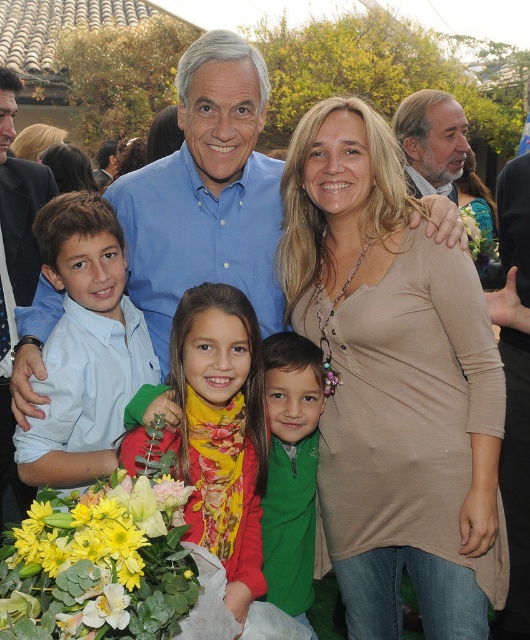
Does yellow matte flowers at lower left have a larger size compared to green fleece jacket at center?

No, yellow matte flowers at lower left is not bigger than green fleece jacket at center.

Is point (189, 582) more distant than point (285, 442)?

No, it is not.

In order to click on yellow matte flowers at lower left in this screenshot , I will do `click(101, 564)`.

Image resolution: width=530 pixels, height=640 pixels. Describe the element at coordinates (393, 384) in the screenshot. I see `beige fabric dress at center` at that location.

Is beige fabric dress at center above blue shirt at center?

Actually, beige fabric dress at center is below blue shirt at center.

Describe the element at coordinates (393, 384) in the screenshot. The height and width of the screenshot is (640, 530). I see `beige fabric dress at center` at that location.

At what (x,y) coordinates should I click in order to perform the action: click on beige fabric dress at center. Please return your answer as a coordinate pair (x, y). This screenshot has height=640, width=530. Looking at the image, I should click on click(x=393, y=384).

Between yellow floral scarf at center and gray hair man at upper right, which one appears on the right side from the viewer's perspective?

From the viewer's perspective, gray hair man at upper right appears more on the right side.

Which is in front, point (233, 404) or point (436, 172)?

Point (233, 404) is more forward.

Is point (227, 413) positioned after point (429, 179)?

No, it is not.

Where is `yellow floral scarf at center`? Image resolution: width=530 pixels, height=640 pixels. yellow floral scarf at center is located at coordinates click(x=222, y=432).